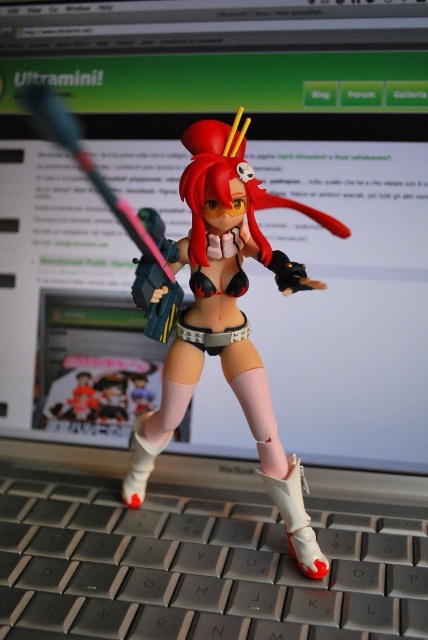
Question: Among these points, which one is farthest from the camera?

Choices:
 (A) (83, 604)
 (B) (232, 186)

Answer: (A)

Question: Which point is closer to the camera taking this photo?

Choices:
 (A) (210, 568)
 (B) (285, 282)

Answer: (B)

Question: Is gray plastic keyboard at lower center positioned at the back of satin black figure at center?

Choices:
 (A) yes
 (B) no

Answer: (A)

Question: Does gray plastic keyboard at lower center have a greater width compared to satin black figure at center?

Choices:
 (A) yes
 (B) no

Answer: (A)

Question: Which point appears closest to the camera in this image?

Choices:
 (A) (71, 522)
 (B) (222, 221)

Answer: (B)

Question: Does gray plastic keyboard at lower center appear under satin black figure at center?

Choices:
 (A) yes
 (B) no

Answer: (A)